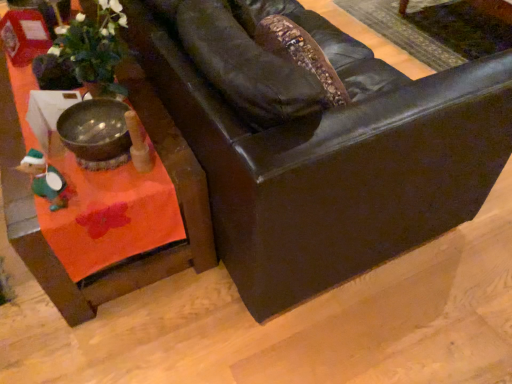
Identify the location of free space to the left of green felt toy at lower left. Image resolution: width=512 pixels, height=384 pixels. (20, 197).